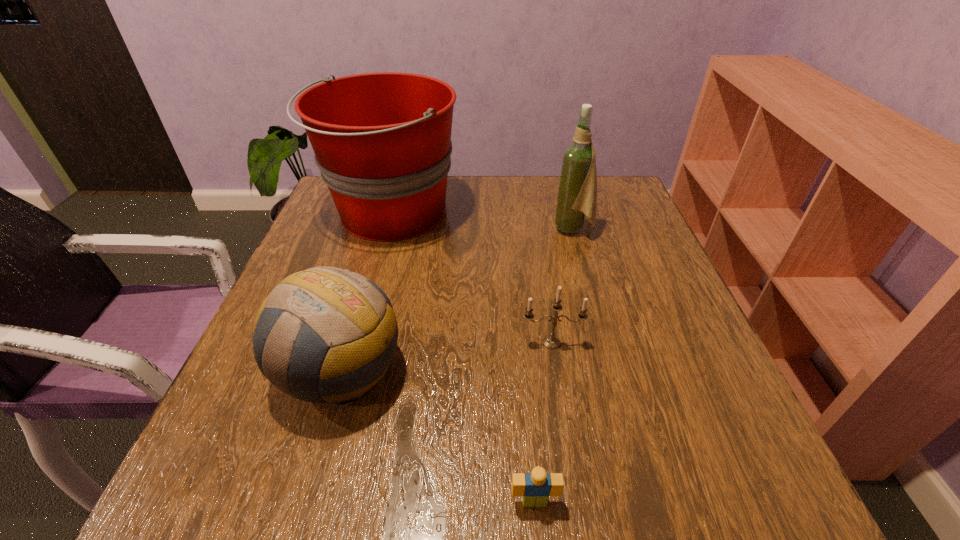
Identify the location of bucket. tap(382, 141).

Locate an element on the screen. wine bottle is located at coordinates (577, 194).

Locate an element on the screen. the third shortest object is located at coordinates (327, 335).

Locate an element on the screen. candle is located at coordinates (552, 342).

Identify the location of the shortest object. Image resolution: width=960 pixels, height=540 pixels. (535, 488).

At what (x,y) coordinates should I click in order to perform the action: click on Lego. Please return your answer as a coordinate pair (x, y). This screenshot has height=540, width=960. Looking at the image, I should click on (535, 488).

This screenshot has width=960, height=540. I want to click on free space located 0.200m on the right of the bucket, so click(x=538, y=213).

Identify the location of vacant space located 0.050m on the front-facing side of the wine bottle. This screenshot has width=960, height=540. (533, 229).

Where is `free location located on the front-facing side of the wine bottle`? Image resolution: width=960 pixels, height=540 pixels. free location located on the front-facing side of the wine bottle is located at coordinates (529, 229).

Find the location of a particular element. The image size is (960, 540). vacant space located on the front-facing side of the wine bottle is located at coordinates 525,229.